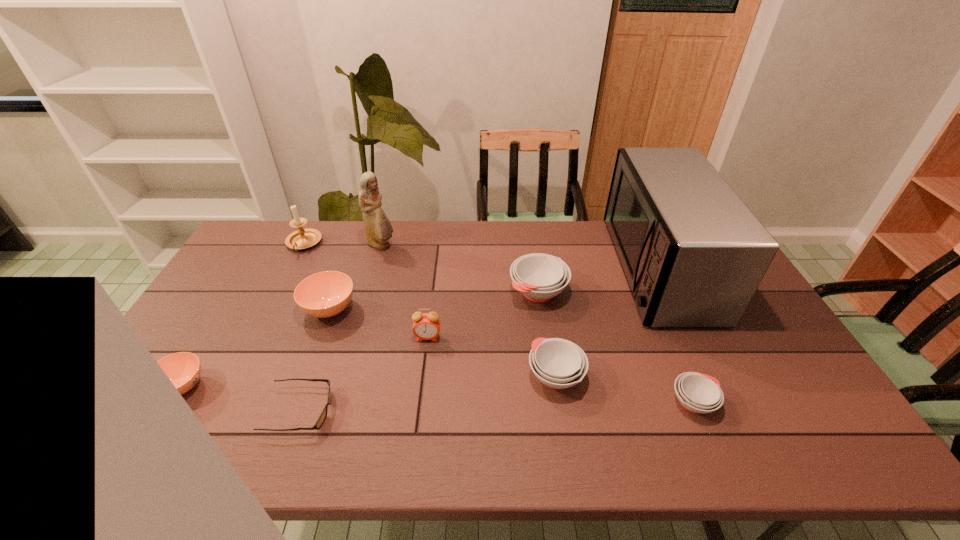
Image resolution: width=960 pixels, height=540 pixels. Find the location of `vacant space positioned 0.150m on the face of the fifth nearest object`. vacant space positioned 0.150m on the face of the fifth nearest object is located at coordinates [421, 387].

The height and width of the screenshot is (540, 960). Identify the location of vacant area situated on the left of the biggest white soup bowl. (390, 292).

The image size is (960, 540). Identify the location of vacant point located 0.350m on the right of the bigger peach soup bowl. (471, 309).

Identify the location of vacant area situated on the left of the second biggest white soup bowl. Image resolution: width=960 pixels, height=540 pixels. (421, 376).

Locate an element on the screen. This screenshot has height=540, width=960. free spot located 0.330m on the right of the leftmost soup bowl is located at coordinates (334, 387).

Find the location of a particular element. vacant space located on the right of the rightmost white soup bowl is located at coordinates (753, 402).

Image resolution: width=960 pixels, height=540 pixels. I want to click on blank area located 0.260m on the front-facing side of the shortest object, so click(438, 410).

Identify the location of microwave_oven present at the far edge. Image resolution: width=960 pixels, height=540 pixels. (693, 254).

The width and height of the screenshot is (960, 540). Identify the location of figurine that is at the far edge. pos(378,228).

Image resolution: width=960 pixels, height=540 pixels. I want to click on candle holder that is at the far edge, so click(302, 238).